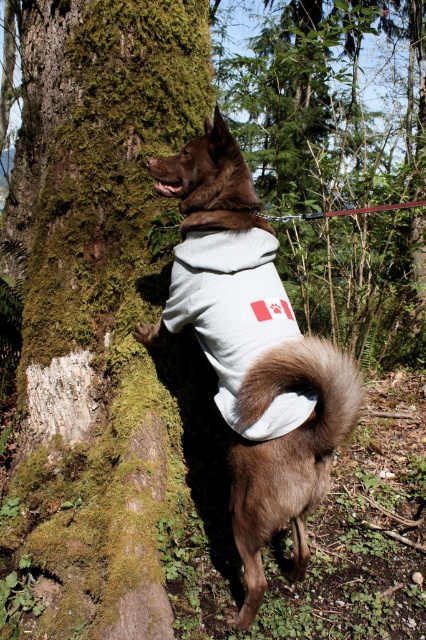
Between green mossy bark at left and brown fur coat at center, which one has less height?

Standing shorter between the two is brown fur coat at center.

Between green mossy bark at left and brown fur coat at center, which one appears on the left side from the viewer's perspective?

green mossy bark at left is more to the left.

Which is behind, point (103, 100) or point (247, 204)?

Point (103, 100)

You are a GUI agent. You are given a task and a screenshot of the screen. Output one action in this format:
    pyautogui.click(x=<x>, y=<y>)
    Task: Click on the green mossy bark at left
    The width and height of the screenshot is (426, 640).
    Given the screenshot: What is the action you would take?
    pyautogui.click(x=104, y=332)